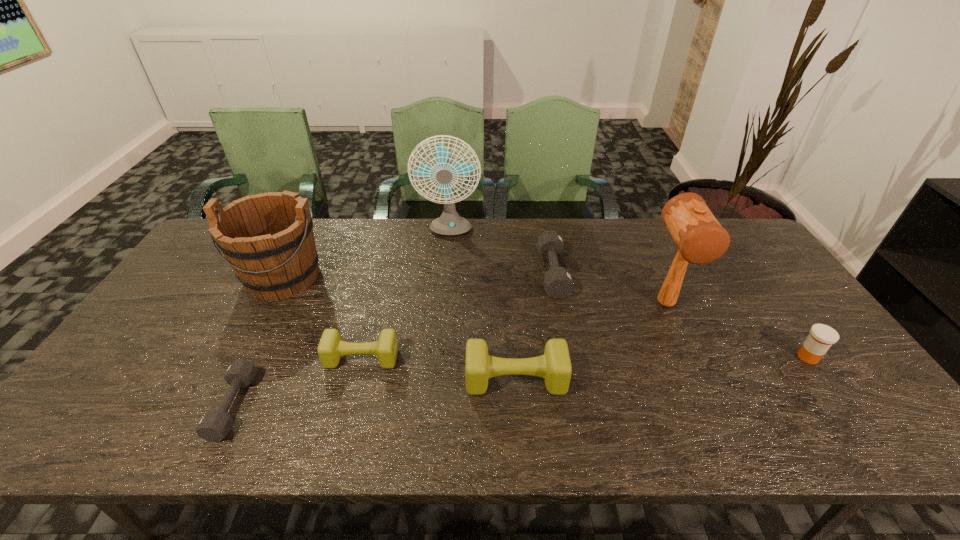
This screenshot has height=540, width=960. Identify the location of free point between the leftmost dumbbell and the mallet. (449, 355).

At what (x,y) coordinates should I click in order to perform the action: click on the fifth closest object to the mallet. Please return your answer as a coordinate pair (x, y). Image resolution: width=960 pixels, height=540 pixels. Looking at the image, I should click on (331, 347).

Point out which object is positioned as the fourth nearest to the mallet. Please provide its 2D coordinates. Your answer should be formatted as a tuple, i.e. [(x, y)], where the tuple contains the x and y coordinates of a point satisfying the conditions above.

[(449, 223)]

Point out which dumbbell is positioned as the fourth nearest to the wine bucket. Please provide its 2D coordinates. Your answer should be formatted as a tuple, i.e. [(x, y)], where the tuple contains the x and y coordinates of a point satisfying the conditions above.

[(558, 283)]

Where is `dumbbell that is the fourth nearest to the second object from right to left`? This screenshot has width=960, height=540. dumbbell that is the fourth nearest to the second object from right to left is located at coordinates (214, 425).

Where is `vacant area that satisfies the following two spatial constraints: 1. on the front-facing side of the farthest dumbbell; 2. on the right side of the farthest object`? The image size is (960, 540). vacant area that satisfies the following two spatial constraints: 1. on the front-facing side of the farthest dumbbell; 2. on the right side of the farthest object is located at coordinates (445, 273).